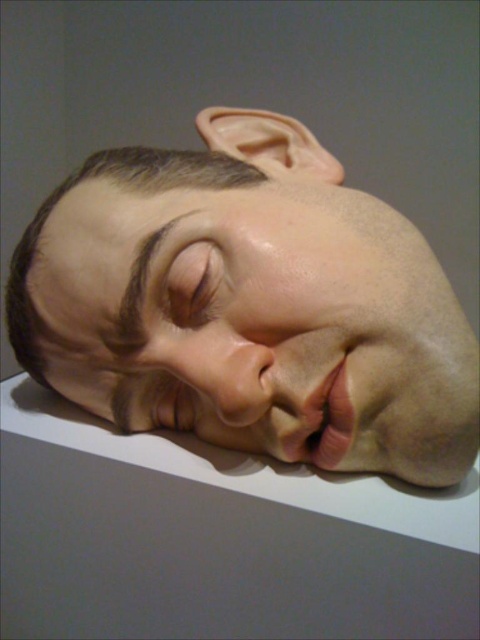
Between point (154, 269) and point (206, 323), which one is positioned behind?

The point (206, 323) is behind.

Can you confirm if smooth skin head at center is positioned below matte flesh-colored eye at center?

Incorrect, smooth skin head at center is not positioned below matte flesh-colored eye at center.

The height and width of the screenshot is (640, 480). What do you see at coordinates (251, 307) in the screenshot? I see `smooth skin head at center` at bounding box center [251, 307].

The image size is (480, 640). In order to click on smooth skin head at center in this screenshot , I will do `click(251, 307)`.